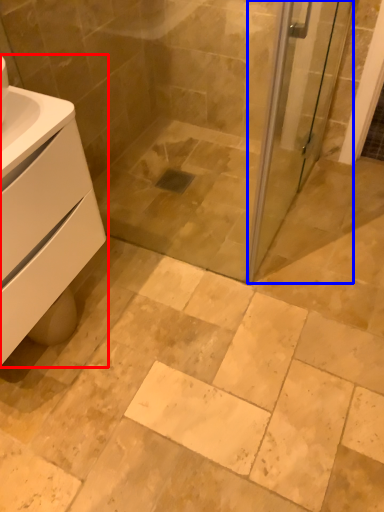
Question: Which object appears farthest to the camera in this image, bathroom cabinet (highlighted by a red box) or screen door (highlighted by a blue box)?

Choices:
 (A) bathroom cabinet
 (B) screen door

Answer: (B)